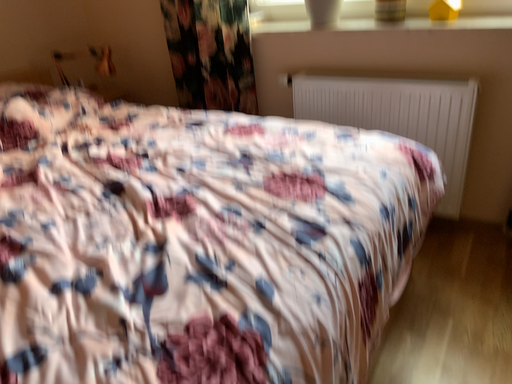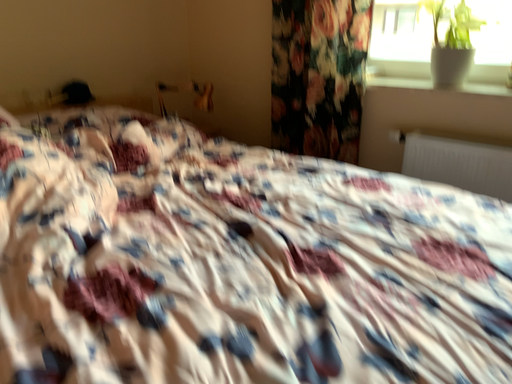
Question: Which way did the camera rotate in the video?

Choices:
 (A) rotated upward
 (B) rotated downward

Answer: (A)